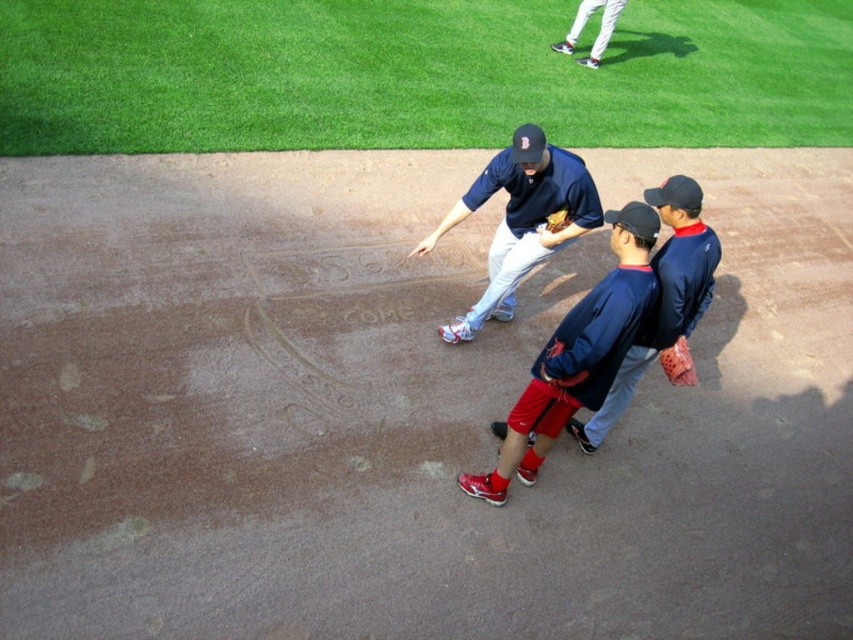
Can you confirm if blue fabric jacket at center is shorter than brown leather glove at center?

No, blue fabric jacket at center is not shorter than brown leather glove at center.

Is point (688, 241) farther from camera compared to point (550, 221)?

No, it is in front of (550, 221).

Is point (675, 253) behind point (556, 212)?

No, it is in front of (556, 212).

What are the coordinates of `blue fabric jacket at center` in the screenshot? It's located at (662, 298).

Between blue fabric baseball uniform at center and orange leather glove at lower right, which one has less height?

Standing shorter between the two is orange leather glove at lower right.

Is blue fabric baseball uniform at center positioned before orange leather glove at lower right?

No.

Is point (612, 349) more distant than point (683, 355)?

That is False.

Identify the location of blue fabric baseball uniform at center. (569, 310).

Between blue fabric jacket at center and white baseball pants at upper center, which one appears on the left side from the viewer's perspective?

blue fabric jacket at center is more to the left.

Which is behind, point (671, 211) or point (584, 8)?

Point (584, 8)

Who is more forward, (675, 186) or (611, 13)?

Positioned in front is point (675, 186).

This screenshot has width=853, height=640. I want to click on blue fabric jacket at center, so click(x=662, y=298).